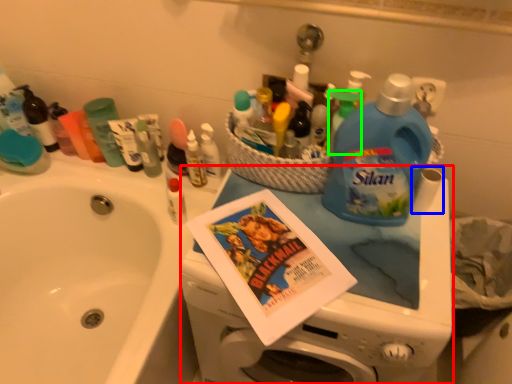
Question: Based on their relative distances, which object is nearer to appliance (highlighted by a red box)? Choose from toilet paper (highlighted by a blue box) and cleaning product (highlighted by a green box).

Choices:
 (A) toilet paper
 (B) cleaning product

Answer: (A)